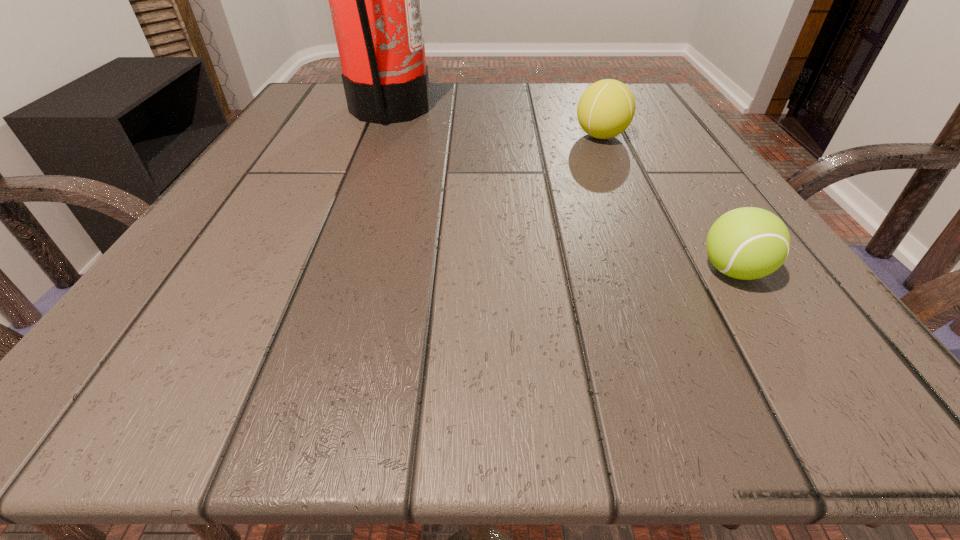
The height and width of the screenshot is (540, 960). I want to click on vacant area that satisfies the following two spatial constraints: 1. on the front side of the tallest object; 2. on the left side of the nearer tennis ball, so click(330, 271).

Identify the location of free spot that satisfies the following two spatial constraints: 1. on the front side of the shortest object; 2. on the right side of the leftmost object. Image resolution: width=960 pixels, height=540 pixels. (330, 271).